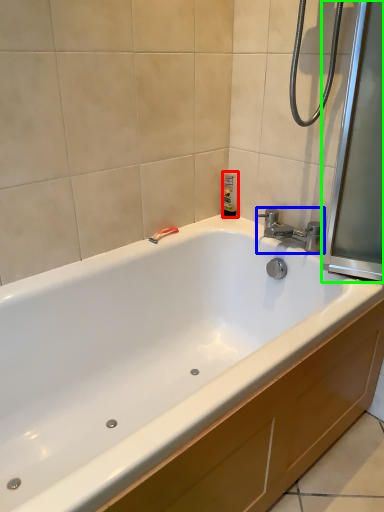
Question: Which is farther away from toiletry (highlighted by a red box)? tap (highlighted by a blue box) or screen door (highlighted by a green box)?

Choices:
 (A) tap
 (B) screen door

Answer: (B)